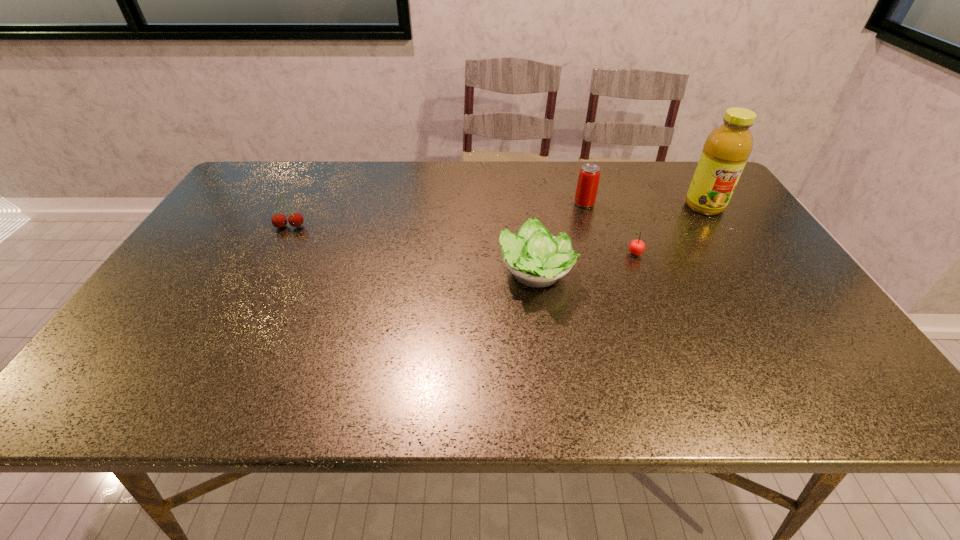
You are a GUI agent. You are given a task and a screenshot of the screen. Output one action in this format:
    pyautogui.click(x=<x>, y=<y>)
    Task: Click on the free space located on the surface of the third farthest object
    
    Given the screenshot: What is the action you would take?
    pyautogui.click(x=281, y=242)

Identify the location of free location located 0.370m on the back of the second object from left to right. This screenshot has width=960, height=540. (522, 177).

Where is `free region located on the front of the right cherry`? free region located on the front of the right cherry is located at coordinates (659, 314).

Find the location of a particular element. The width and height of the screenshot is (960, 540). fruit juice that is at the far edge is located at coordinates (726, 150).

This screenshot has height=540, width=960. Find the location of `beer can that is positioned at the far edge`. beer can that is positioned at the far edge is located at coordinates (587, 186).

The height and width of the screenshot is (540, 960). Identify the location of object located in the right edge section of the desktop. (726, 150).

You are a GUI agent. You are given a task and a screenshot of the screen. Output one action in this format:
    pyautogui.click(x=<x>, y=<y>)
    Task: Click on the object present at the far right corner
    The image size is (960, 540).
    Given the screenshot: What is the action you would take?
    pyautogui.click(x=726, y=150)

Locate an element on the screen. Image resolution: width=960 pixels, height=540 pixels. vacant space at the far edge is located at coordinates click(x=604, y=190).

Find the location of a particular element. The width and height of the screenshot is (960, 540). free space at the near edge is located at coordinates coord(777,378).

Identify the location of blank space at the left edge of the desktop. Image resolution: width=960 pixels, height=540 pixels. (242, 255).